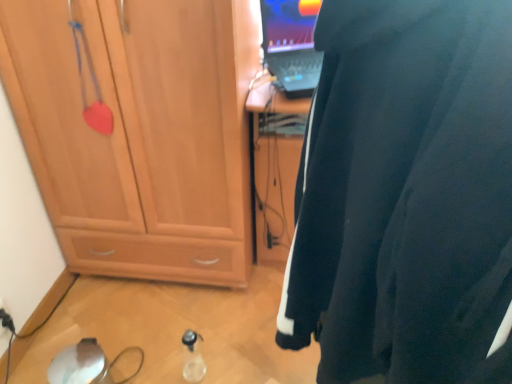
What do you see at coordinates (404, 192) in the screenshot? The width and height of the screenshot is (512, 384). I see `black fabric wetsuit at right` at bounding box center [404, 192].

You are a GUI agent. You are given a task and a screenshot of the screen. Output one action in this format:
    pyautogui.click(x=<x>, y=<y>)
    Task: Click on the matte wood cabinet at left
    Image resolution: width=512 pixels, height=384 pixels.
    Given the screenshot: What is the action you would take?
    pyautogui.click(x=140, y=133)

This screenshot has height=384, width=512. What do you see at coordinates (5, 320) in the screenshot? I see `black plastic electric outlet at lower left` at bounding box center [5, 320].

Image resolution: width=512 pixels, height=384 pixels. What do you see at coordinates (193, 357) in the screenshot?
I see `transparent plastic bottle at lower center` at bounding box center [193, 357].

Image resolution: width=512 pixels, height=384 pixels. Identify the location of black fabric wetsuit at right. (404, 192).

How many degrees apart are the facing directions of black fabric wetsuit at right and matte wood cabinet at left?

There is a 116-degree angle between the facing directions of black fabric wetsuit at right and matte wood cabinet at left.

Is black fabric wetsuit at right surrounding matte wood cabinet at left?

No, matte wood cabinet at left is not inside black fabric wetsuit at right.

In the scene shown: From the image's perspective, is black fabric wetsuit at right above or below matte wood cabinet at left?

black fabric wetsuit at right is below matte wood cabinet at left.

Does transparent plastic bottle at lower center have a greater height compared to matte wood cabinet at left?

Incorrect, the height of transparent plastic bottle at lower center is not larger of that of matte wood cabinet at left.

In order to click on cabinetry located above the transparent plastic bottle at lower center (from a real-world perspective) in this screenshot , I will do `click(140, 133)`.

From a real-world perspective, is transparent plastic bottle at lower center under matte wood cabinet at left?

Yes, from a real-world perspective, transparent plastic bottle at lower center is below matte wood cabinet at left.

From the image's perspective, is transparent plastic bottle at lower center located beneath matte wood cabinet at left?

Yes.

Which of these two, black plastic electric outlet at lower left or transparent plastic bottle at lower center, stands shorter?

black plastic electric outlet at lower left is shorter.

Which is more to the right, black plastic electric outlet at lower left or transparent plastic bottle at lower center?

transparent plastic bottle at lower center is more to the right.

Which object is closer to the camera, black plastic electric outlet at lower left or transparent plastic bottle at lower center?

Positioned in front is transparent plastic bottle at lower center.

Considering the sizes of black plastic electric outlet at lower left and transparent plastic bottle at lower center in the image, is black plastic electric outlet at lower left wider or thinner than transparent plastic bottle at lower center?

Considering their sizes, black plastic electric outlet at lower left looks slimmer than transparent plastic bottle at lower center.

Who is shorter, black fabric wetsuit at right or transparent plastic bottle at lower center?

transparent plastic bottle at lower center.

From the image's perspective, is black fabric wetsuit at right located beneath transparent plastic bottle at lower center?

Actually, black fabric wetsuit at right appears above transparent plastic bottle at lower center in the image.

Consider the image. Would you consider black fabric wetsuit at right to be distant from transparent plastic bottle at lower center?

Actually, black fabric wetsuit at right and transparent plastic bottle at lower center are a little close together.

Can transparent plastic bottle at lower center be found inside black fabric wetsuit at right?

No, black fabric wetsuit at right does not contain transparent plastic bottle at lower center.

Is matte wood cabinet at left not close to black fabric wetsuit at right?

matte wood cabinet at left is near black fabric wetsuit at right, not far away.

Based on the photo, between matte wood cabinet at left and black fabric wetsuit at right, which one has larger size?

black fabric wetsuit at right.

Is matte wood cabinet at left inside or outside of black fabric wetsuit at right?

matte wood cabinet at left is located beyond the bounds of black fabric wetsuit at right.

How distant is black fabric wetsuit at right from black plastic electric outlet at lower left?

The distance of black fabric wetsuit at right from black plastic electric outlet at lower left is 1.44 meters.

In the scene shown: Are black fabric wetsuit at right and black plastic electric outlet at lower left making contact?

black fabric wetsuit at right is not next to black plastic electric outlet at lower left, and they're not touching.

Does black fabric wetsuit at right turn towards black plastic electric outlet at lower left?

No, black fabric wetsuit at right is not facing towards black plastic electric outlet at lower left.

Looking at this image, which of these two, black fabric wetsuit at right or black plastic electric outlet at lower left, is bigger?

Bigger between the two is black fabric wetsuit at right.

From the picture: Is black plastic electric outlet at lower left beside matte wood cabinet at left?

They are not placed beside each other.

Measure the distance between black plastic electric outlet at lower left and matte wood cabinet at left.

black plastic electric outlet at lower left is 75.36 centimeters away from matte wood cabinet at left.

Is black plastic electric outlet at lower left to the left or to the right of matte wood cabinet at left in the image?

black plastic electric outlet at lower left is to the left of matte wood cabinet at left.

From the image's perspective, is black plastic electric outlet at lower left on top of matte wood cabinet at left?

Actually, black plastic electric outlet at lower left appears below matte wood cabinet at left in the image.

Image resolution: width=512 pixels, height=384 pixels. I want to click on wetsuit that appears in front of the matte wood cabinet at left, so click(404, 192).

This screenshot has width=512, height=384. Find the location of `cabinetry above the transparent plastic bottle at lower center (from a real-world perspective)`. cabinetry above the transparent plastic bottle at lower center (from a real-world perspective) is located at coordinates (140, 133).

Based on the photo, based on their spatial positions, is black plastic electric outlet at lower left or black fabric wetsuit at right further from transparent plastic bottle at lower center?

black fabric wetsuit at right is positioned further to the anchor transparent plastic bottle at lower center.

Which object lies nearer to the anchor point matte wood cabinet at left, black plastic electric outlet at lower left or transparent plastic bottle at lower center?

Based on the image, transparent plastic bottle at lower center appears to be nearer to matte wood cabinet at left.

When comparing their distances from black fabric wetsuit at right, does black plastic electric outlet at lower left or transparent plastic bottle at lower center seem further?

black plastic electric outlet at lower left lies further to black fabric wetsuit at right than the other object.

Looking at the image, which one is located closer to transparent plastic bottle at lower center, black fabric wetsuit at right or black plastic electric outlet at lower left?

Based on the image, black plastic electric outlet at lower left appears to be nearer to transparent plastic bottle at lower center.

Which object lies nearer to the anchor point black plastic electric outlet at lower left, black fabric wetsuit at right or matte wood cabinet at left?

matte wood cabinet at left lies closer to black plastic electric outlet at lower left than the other object.

Looking at the image, which one is located closer to transparent plastic bottle at lower center, black plastic electric outlet at lower left or matte wood cabinet at left?

Among the two, matte wood cabinet at left is located nearer to transparent plastic bottle at lower center.

When comparing their distances from transparent plastic bottle at lower center, does matte wood cabinet at left or black plastic electric outlet at lower left seem closer?

The object closer to transparent plastic bottle at lower center is matte wood cabinet at left.

From the image, which object appears to be farther from black plastic electric outlet at lower left, matte wood cabinet at left or transparent plastic bottle at lower center?

matte wood cabinet at left.

Where is `electric outlet between matte wood cabinet at left and transparent plastic bottle at lower center in the up-down direction`? Image resolution: width=512 pixels, height=384 pixels. electric outlet between matte wood cabinet at left and transparent plastic bottle at lower center in the up-down direction is located at coordinates (5, 320).

You are a GUI agent. You are given a task and a screenshot of the screen. Output one action in this format:
    pyautogui.click(x=<x>, y=<y>)
    Task: Click on the bottle between black fabric wetsuit at right and black plastic electric outlet at lower left in the front-back direction
    
    Given the screenshot: What is the action you would take?
    pyautogui.click(x=193, y=357)

Find the location of a particular element. This screenshot has width=512, height=384. cabinetry positioned between black fabric wetsuit at right and transparent plastic bottle at lower center from near to far is located at coordinates [x=140, y=133].

The image size is (512, 384). In order to click on cabinetry positioned between black fabric wetsuit at right and black plastic electric outlet at lower left from near to far in this screenshot , I will do `click(140, 133)`.